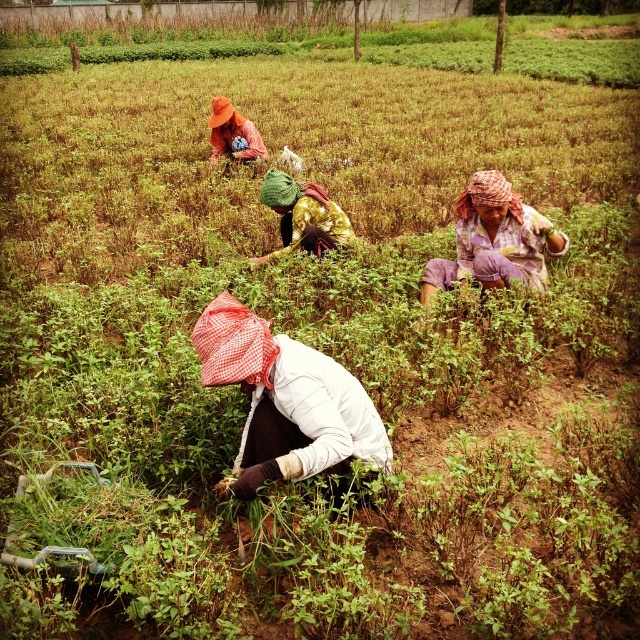
In the scene shown: You are a drone operator trying to locate a specific object in an agricultural field. The scene shows a field with rows of green plants and workers in practical clothing. You need to identify the exact location of the green fabric headscarf at center. What are its coordinates?

The green fabric headscarf at center is located at coordinates point (301,216).

You are a photographer trying to capture a photo of the orange fabric hat at upper center and the plaid fabric headscarf at center. From the perspective of someone standing at the edge of the field, which object would you need to pan your camera to the right to include in the frame first?

The plaid fabric headscarf at center is to the right of the orange fabric hat at upper center, so you would need to pan your camera to the right to include the plaid fabric headscarf at center first.